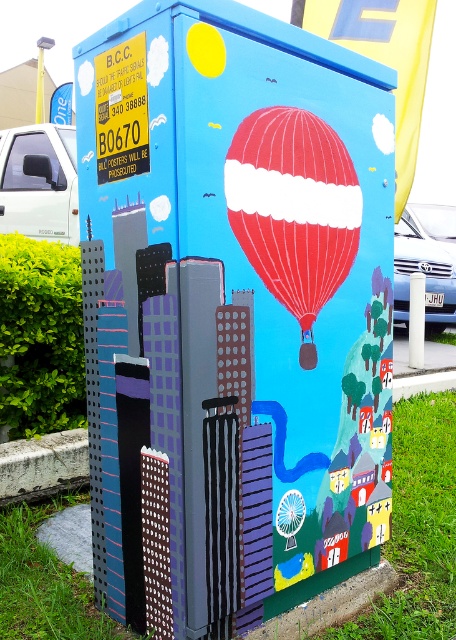
You are an artist standing in front of the utility box. You want to paint a new object between the matte blue building at center and the red glossy hot air balloon at center. Is there space to place it?

The matte blue building at center is in front of the red glossy hot air balloon at center, so there is no space between them to place another object.

You are an artist planning to paint a new mural on a similar utility box. You want to ensure that the matte blue building at center and the red glossy hot air balloon at center maintain their current proportions. If you decide to make the hot air balloon twice as wide as it currently is, will the building still be taller than the balloon?

The matte blue building at center is taller than the red glossy hot air balloon at center. However, if the hot air balloon is made twice as wide, the question of height versus width becomes a comparison of different dimensions. Since the original description only specifies the height comparison, the building will still be taller in height, but the balloon will be wider. The building remains taller in height, so yes, it will still be taller than the balloon.